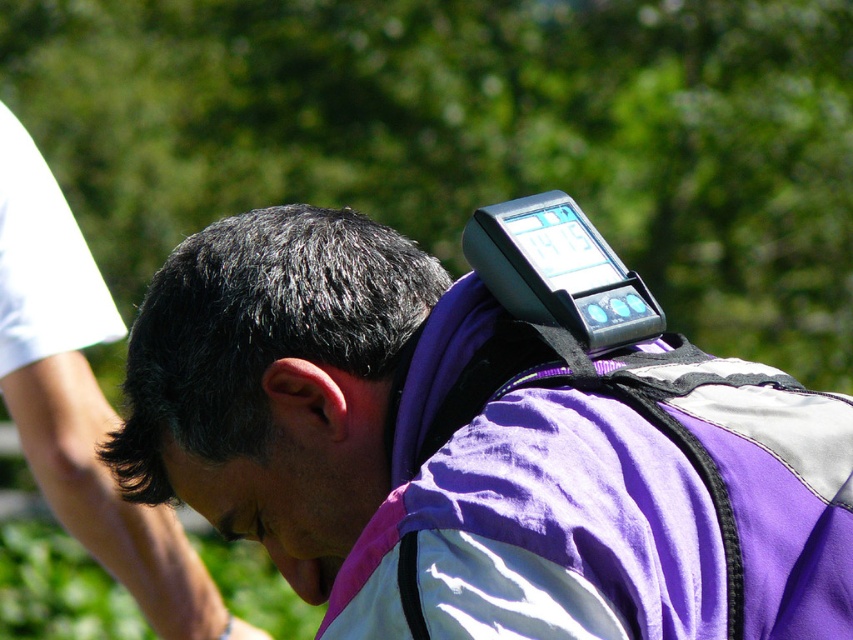
Question: Is purple fabric backpack at upper center in front of black matte hair at center?

Choices:
 (A) no
 (B) yes

Answer: (B)

Question: Is purple fabric backpack at upper center below matte black forehead at center?

Choices:
 (A) no
 (B) yes

Answer: (A)

Question: Estimate the real-world distances between objects in this image. Which object is farther from the matte black forehead at center?

Choices:
 (A) black matte hair at center
 (B) purple fabric backpack at upper center

Answer: (B)

Question: Estimate the real-world distances between objects in this image. Which object is farther from the black matte hair at center?

Choices:
 (A) matte black forehead at center
 (B) purple fabric backpack at upper center

Answer: (B)

Question: Can you confirm if black matte hair at center is smaller than matte black forehead at center?

Choices:
 (A) no
 (B) yes

Answer: (A)

Question: Which point is closer to the camera?

Choices:
 (A) black matte hair at center
 (B) matte black forehead at center
 (C) purple fabric backpack at upper center

Answer: (C)